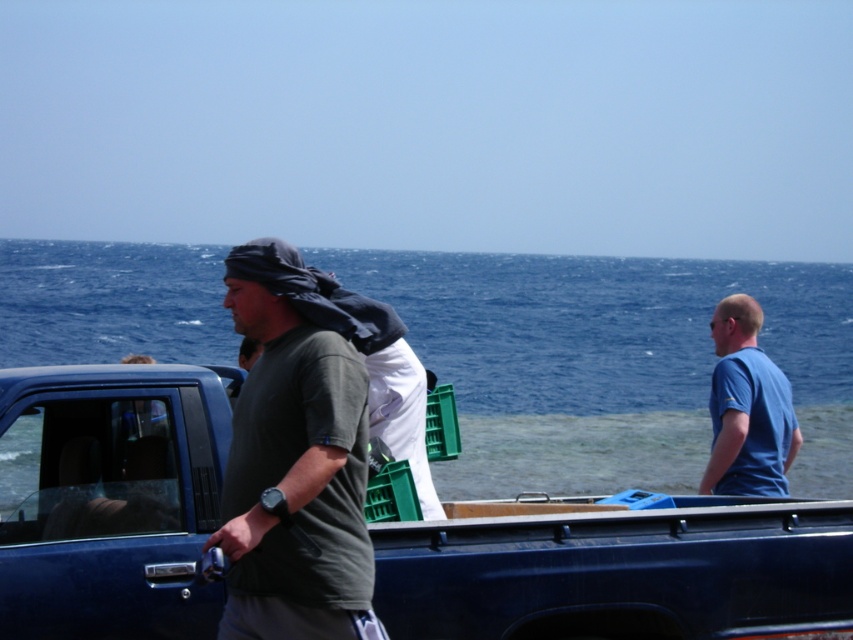
Can you confirm if dark green fabric truck at center is positioned above blue matte shirt at right?

Yes.

Between point (288, 316) and point (722, 339), which one is positioned behind?

The point (722, 339) is more distant.

Is point (234, 246) behind point (732, 404)?

No, it is not.

Where is `dark green fabric truck at center`? The width and height of the screenshot is (853, 640). dark green fabric truck at center is located at coordinates (294, 458).

Is blue water at center to the right of dark green fabric truck at center from the viewer's perspective?

In fact, blue water at center is to the left of dark green fabric truck at center.

Does blue water at center appear on the left side of dark green fabric truck at center?

Indeed, blue water at center is positioned on the left side of dark green fabric truck at center.

Measure the distance between point (798, 272) and camera.

Point (798, 272) is 129.53 meters from camera.

The height and width of the screenshot is (640, 853). I want to click on blue water at center, so [608, 362].

Does blue water at center appear on the right side of blue matte shirt at right?

Incorrect, blue water at center is not on the right side of blue matte shirt at right.

Can you confirm if blue water at center is positioned above blue matte shirt at right?

Correct, blue water at center is located above blue matte shirt at right.

Between point (815, 365) and point (723, 312), which one is positioned in front?

Point (723, 312)

The image size is (853, 640). In order to click on blue water at center in this screenshot , I will do `click(608, 362)`.